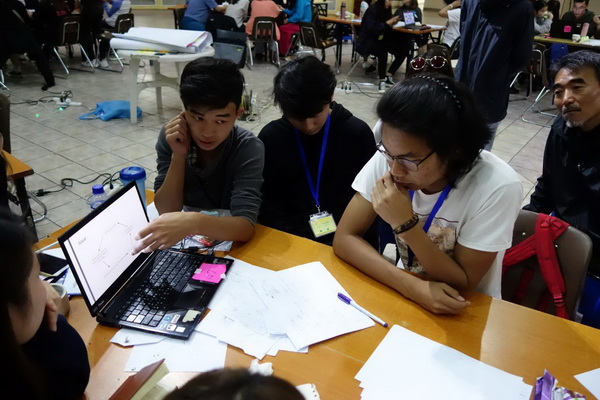
Where is `table`? table is located at coordinates (514, 355), (347, 21), (578, 40), (439, 40).